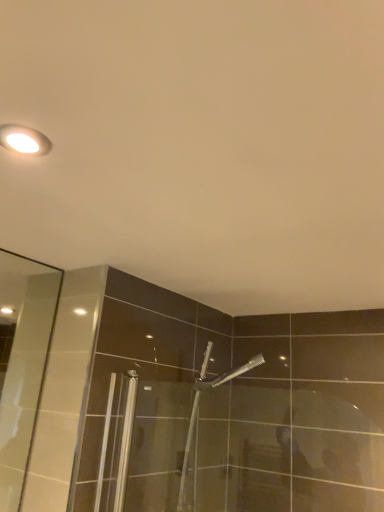
Image resolution: width=384 pixels, height=512 pixels. What do you see at coordinates (24, 140) in the screenshot?
I see `matte white light fixture at upper left` at bounding box center [24, 140].

Locate an element on the screen. The height and width of the screenshot is (512, 384). matte white light fixture at upper left is located at coordinates (24, 140).

What do you see at coordinates (198, 404) in the screenshot?
I see `silver metallic shower head at center` at bounding box center [198, 404].

Find the location of a particular element. silver metallic shower head at center is located at coordinates (198, 404).

Find the location of a particular element. matte white light fixture at upper left is located at coordinates (24, 140).

Is matte white light fixture at upper left to the left of silver metallic shower head at center from the viewer's perspective?

Indeed, matte white light fixture at upper left is positioned on the left side of silver metallic shower head at center.

Does matte white light fixture at upper left lie in front of silver metallic shower head at center?

Yes, matte white light fixture at upper left is closer to the viewer.

Is point (27, 146) closer to camera compared to point (189, 448)?

Yes, point (27, 146) is closer to viewer.

Based on the photo, from the image's perspective, relative to silver metallic shower head at center, is matte white light fixture at upper left above or below?

From the image's perspective, matte white light fixture at upper left appears above silver metallic shower head at center.

From a real-world perspective, is matte white light fixture at upper left physically below silver metallic shower head at center?

No.

Is matte white light fixture at upper left thinner than silver metallic shower head at center?

Indeed, matte white light fixture at upper left has a lesser width compared to silver metallic shower head at center.

Considering the sizes of matte white light fixture at upper left and silver metallic shower head at center in the image, is matte white light fixture at upper left taller or shorter than silver metallic shower head at center?

In the image, matte white light fixture at upper left appears to be shorter than silver metallic shower head at center.

Who is bigger, matte white light fixture at upper left or silver metallic shower head at center?

With larger size is silver metallic shower head at center.

Is matte white light fixture at upper left situated inside silver metallic shower head at center or outside?

matte white light fixture at upper left is not inside silver metallic shower head at center, it's outside.

Is matte white light fixture at upper left far away from silver metallic shower head at center?

matte white light fixture at upper left is positioned a significant distance from silver metallic shower head at center.

Could you tell me if matte white light fixture at upper left is facing silver metallic shower head at center?

No, matte white light fixture at upper left is not aimed at silver metallic shower head at center.

Where is `light fixture to the left of silver metallic shower head at center`? The width and height of the screenshot is (384, 512). light fixture to the left of silver metallic shower head at center is located at coordinates (24, 140).

From the picture: Does silver metallic shower head at center appear on the left side of matte white light fixture at upper left?

No.

Is silver metallic shower head at center further to the viewer compared to matte white light fixture at upper left?

Yes, it is behind matte white light fixture at upper left.

Is point (208, 355) closer to camera compared to point (19, 141)?

No, (208, 355) is behind (19, 141).

From the image's perspective, which object appears higher, silver metallic shower head at center or matte white light fixture at upper left?

matte white light fixture at upper left appears higher in the image.

From a real-world perspective, which is physically below, silver metallic shower head at center or matte white light fixture at upper left?

From a 3D spatial view, silver metallic shower head at center is below.

Considering the sizes of objects silver metallic shower head at center and matte white light fixture at upper left in the image provided, who is wider, silver metallic shower head at center or matte white light fixture at upper left?

silver metallic shower head at center.

Which of these two, silver metallic shower head at center or matte white light fixture at upper left, stands shorter?

matte white light fixture at upper left is shorter.

Can you confirm if silver metallic shower head at center is bigger than matte white light fixture at upper left?

Indeed, silver metallic shower head at center has a larger size compared to matte white light fixture at upper left.

Would you say silver metallic shower head at center is inside or outside matte white light fixture at upper left?

silver metallic shower head at center is outside matte white light fixture at upper left.

Is silver metallic shower head at center positioned far away from matte white light fixture at upper left?

Yes.

Is silver metallic shower head at center aimed at matte white light fixture at upper left?

No, silver metallic shower head at center does not turn towards matte white light fixture at upper left.

Find the location of a particular element. This screenshot has width=384, height=512. light fixture in front of the silver metallic shower head at center is located at coordinates (24, 140).

Identify the location of shower that is below the matte white light fixture at upper left (from the image's perspective). The height and width of the screenshot is (512, 384). (198, 404).

At what (x,y) coordinates should I click in order to perform the action: click on shower on the right of matte white light fixture at upper left. Please return your answer as a coordinate pair (x, y). Image resolution: width=384 pixels, height=512 pixels. Looking at the image, I should click on (198, 404).